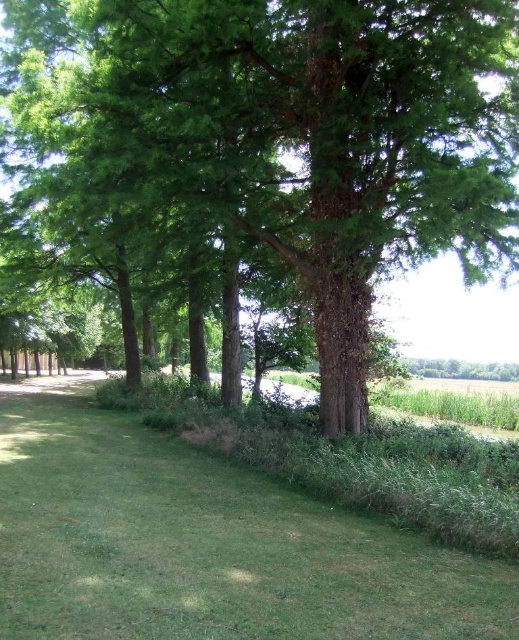
You are a hiker who wants to know which is wider between the green rough bark tree at center and the green grass at lower center. Which one is wider?

The green rough bark tree at center has a lesser width compared to green grass at lower center, so the green grass at lower center is wider.

You are standing on the green grass at lower center in the scene. Looking up, which direction would you see the green rough bark tree at center?

Looking up from the green grass at lower center, you would see the green rough bark tree at center above you since it is located above the green grass at lower center.